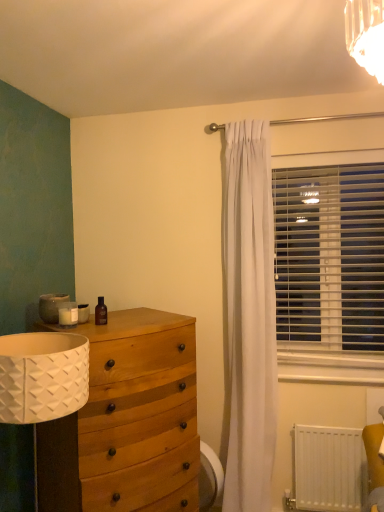
Question: Should I look upward or downward to see wooden chest of drawers at left?

Choices:
 (A) up
 (B) down

Answer: (B)

Question: Is the position of wooden chest of drawers at left less distant than that of white plastic blinds at right?

Choices:
 (A) yes
 (B) no

Answer: (A)

Question: Is wooden chest of drawers at left located outside white plastic blinds at right?

Choices:
 (A) no
 (B) yes

Answer: (B)

Question: Is wooden chest of drawers at left further to the viewer compared to white plastic blinds at right?

Choices:
 (A) no
 (B) yes

Answer: (A)

Question: Is wooden chest of drawers at left looking in the opposite direction of white plastic blinds at right?

Choices:
 (A) yes
 (B) no

Answer: (B)

Question: Is wooden chest of drawers at left directly adjacent to white plastic blinds at right?

Choices:
 (A) yes
 (B) no

Answer: (B)

Question: Is wooden chest of drawers at left to the right of white plastic blinds at right from the viewer's perspective?

Choices:
 (A) yes
 (B) no

Answer: (B)

Question: Is white plastic swivel chair at lower right surrounding white plastic blinds at right?

Choices:
 (A) yes
 (B) no

Answer: (B)

Question: Does white plastic swivel chair at lower right have a greater width compared to white plastic blinds at right?

Choices:
 (A) no
 (B) yes

Answer: (B)

Question: Is white plastic swivel chair at lower right behind white plastic blinds at right?

Choices:
 (A) yes
 (B) no

Answer: (B)

Question: Does white plastic swivel chair at lower right have a smaller size compared to white plastic blinds at right?

Choices:
 (A) yes
 (B) no

Answer: (A)

Question: Is white plastic swivel chair at lower right touching white plastic blinds at right?

Choices:
 (A) no
 (B) yes

Answer: (A)

Question: Is white plastic swivel chair at lower right to the left of white plastic blinds at right from the viewer's perspective?

Choices:
 (A) no
 (B) yes

Answer: (B)

Question: From the image's perspective, is white matte radiator at lower right located above white plastic swivel chair at lower right?

Choices:
 (A) no
 (B) yes

Answer: (B)